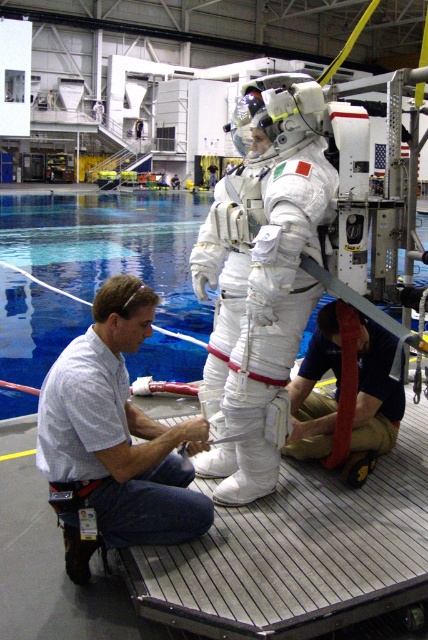
Question: Is white shirt at center below red fabric strap at lower center?

Choices:
 (A) no
 (B) yes

Answer: (B)

Question: Is white matte spacesuit at center smaller than white shirt at center?

Choices:
 (A) no
 (B) yes

Answer: (A)

Question: Estimate the real-world distances between objects in this image. Which object is farther from the white matte spacesuit at center?

Choices:
 (A) red fabric strap at lower center
 (B) blue glossy water at center

Answer: (B)

Question: Does white matte spacesuit at center have a smaller size compared to red fabric strap at lower center?

Choices:
 (A) no
 (B) yes

Answer: (A)

Question: Estimate the real-world distances between objects in this image. Which object is farther from the white shirt at center?

Choices:
 (A) red fabric strap at lower center
 (B) white matte spacesuit at center

Answer: (A)

Question: Which object is closer to the camera taking this photo?

Choices:
 (A) white shirt at center
 (B) red fabric strap at lower center
 (C) white matte spacesuit at center

Answer: (C)